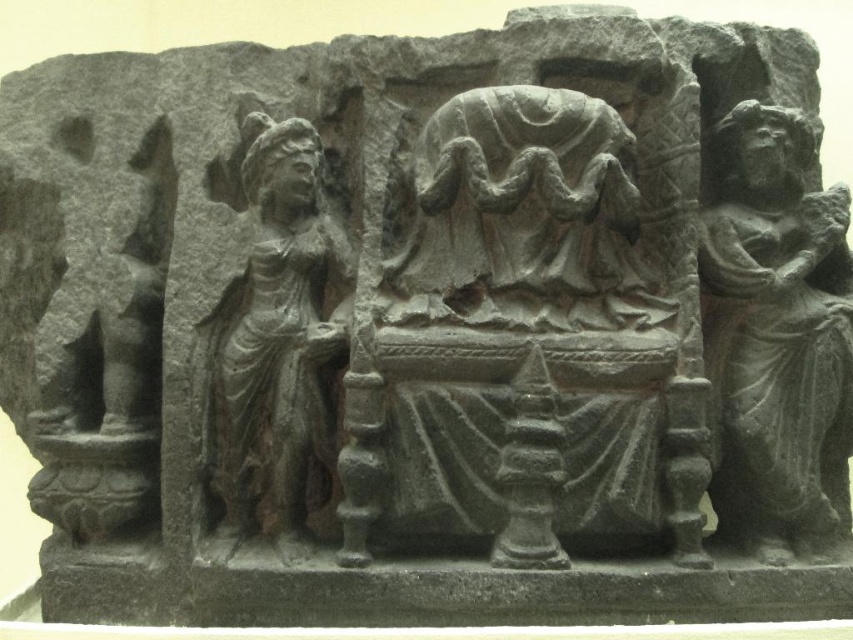
Question: Is dark gray stone figure at right below dark gray stone figure at left?

Choices:
 (A) no
 (B) yes

Answer: (A)

Question: Estimate the real-world distances between objects in this image. Which object is closer to the dark gray stone figure at left?

Choices:
 (A) dark gray stone figure at right
 (B) gray stone figure at center

Answer: (B)

Question: Observing the image, what is the correct spatial positioning of gray stone figure at center in reference to dark gray stone figure at left?

Choices:
 (A) below
 (B) above

Answer: (B)

Question: Does dark gray stone figure at right have a smaller size compared to gray stone figure at center?

Choices:
 (A) yes
 (B) no

Answer: (B)

Question: Estimate the real-world distances between objects in this image. Which object is closer to the dark gray stone figure at left?

Choices:
 (A) dark gray stone figure at right
 (B) gray stone figure at center

Answer: (B)

Question: Among these objects, which one is farthest from the camera?

Choices:
 (A) dark gray stone figure at right
 (B) dark gray stone figure at left
 (C) gray stone figure at center

Answer: (A)